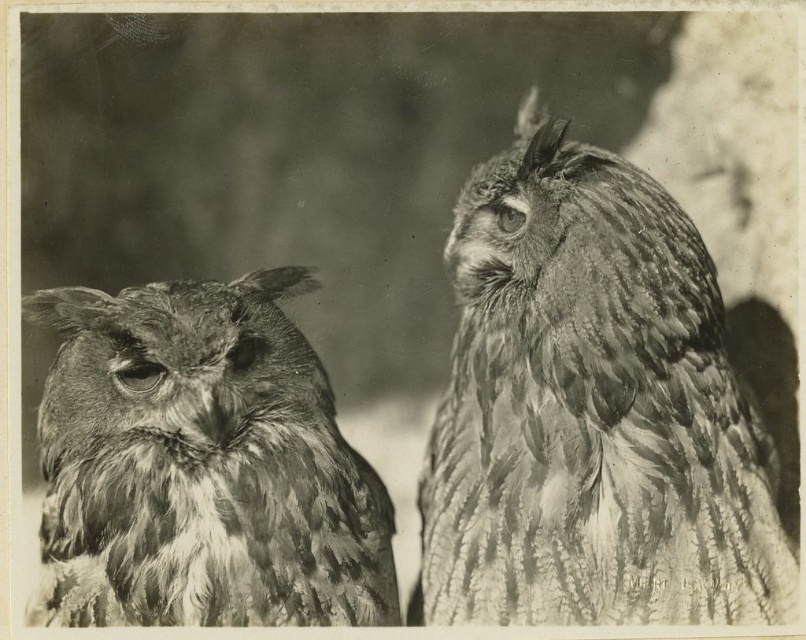
Is point (478, 280) farther from viewer compared to point (84, 424)?

That is True.

Identify the location of ruffled feather owl at right. (592, 410).